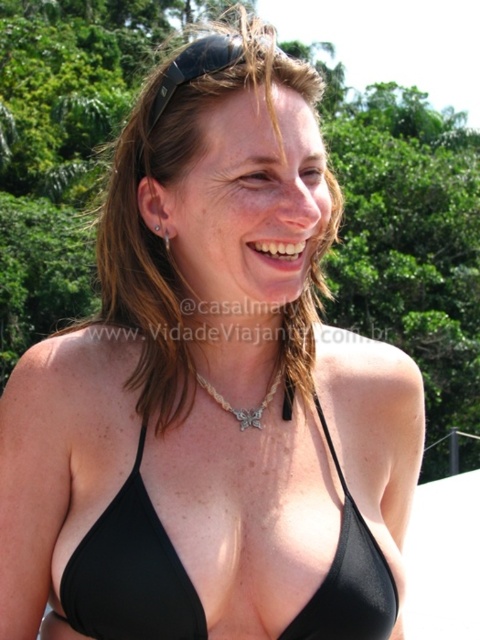
Question: Is silver metallic chain at center behind silver metallic earring at upper left?

Choices:
 (A) yes
 (B) no

Answer: (A)

Question: Which object is the closest to the silver metallic chain at center?

Choices:
 (A) brownhair at center
 (B) silver metallic earring at upper left

Answer: (A)

Question: Which point appears closest to the camera in this image?

Choices:
 (A) 72,572
 (B) 257,420
 (C) 196,92

Answer: (A)

Question: Is black fabric bikini top at center in front of silver metallic earring at upper left?

Choices:
 (A) yes
 (B) no

Answer: (A)

Question: Which is farther from the silver metallic earring at upper left?

Choices:
 (A) brownhair at center
 (B) silver metallic chain at center

Answer: (A)

Question: Is black fabric bikini top at center closer to camera compared to silver metallic chain at center?

Choices:
 (A) no
 (B) yes

Answer: (B)